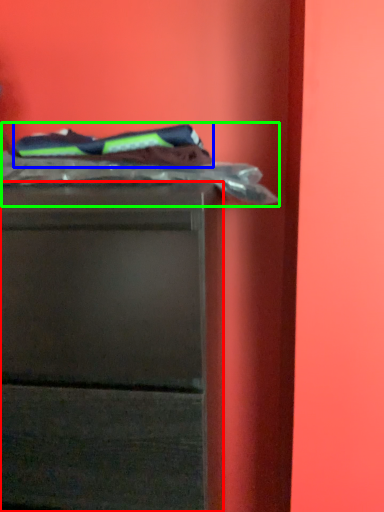
Question: Based on their relative distances, which object is nearer to chest of drawers (highlighted by a red box)? Choose from laundry (highlighted by a blue box) and laundry (highlighted by a green box).

Choices:
 (A) laundry
 (B) laundry

Answer: (B)